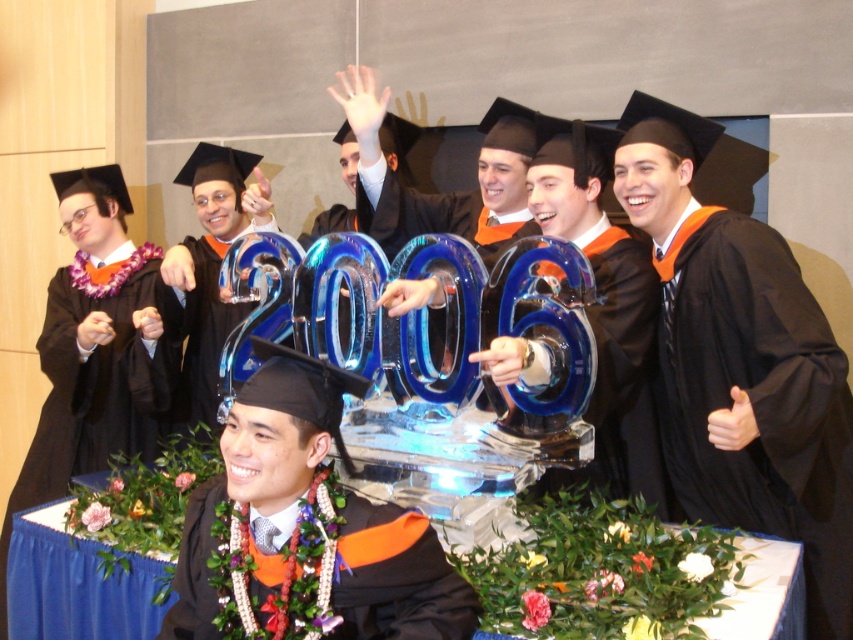
Question: Does black matte gown at center appear under matte black graduation gown at center?

Choices:
 (A) no
 (B) yes

Answer: (B)

Question: Which object appears closest to the camera in this image?

Choices:
 (A) black matte graduation robe at right
 (B) matte black graduation gown at center
 (C) black matte gown at center
 (D) matte black graduation robe at center

Answer: (A)

Question: Which point is closer to the camera taking this photo?

Choices:
 (A) (721, 276)
 (B) (421, 628)
 (C) (634, 449)

Answer: (B)

Question: Considering the relative positions of matte black graduation gown at center and matte black graduation gown at lower center in the image provided, where is matte black graduation gown at center located with respect to matte black graduation gown at lower center?

Choices:
 (A) below
 (B) above

Answer: (B)

Question: Estimate the real-world distances between objects in this image. Which object is farther from the matte black graduation robe at center?

Choices:
 (A) black matte graduation robe at right
 (B) black matte gown at center
 (C) matte black graduation gown at lower center

Answer: (A)

Question: From the image, what is the correct spatial relationship of black matte gown at center in relation to matte black graduation gown at center?

Choices:
 (A) above
 (B) below

Answer: (B)